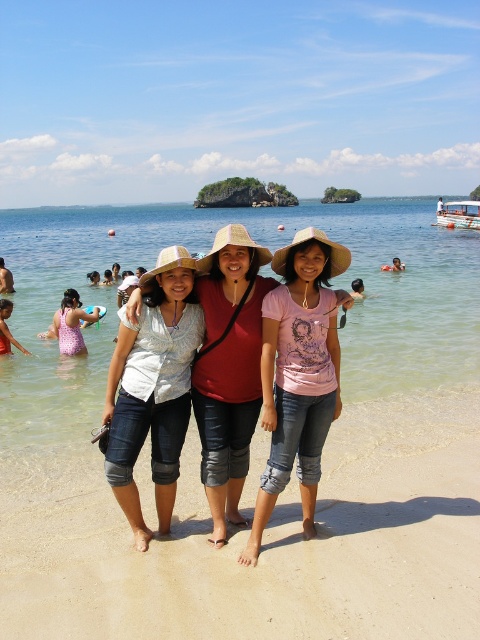
Is denim jeans at center wider than clear water at beach center?

No.

Does denim jeans at center appear over clear water at beach center?

Incorrect, denim jeans at center is not positioned above clear water at beach center.

Describe the element at coordinates (265, 544) in the screenshot. I see `denim jeans at center` at that location.

Where is `denim jeans at center`? The height and width of the screenshot is (640, 480). denim jeans at center is located at coordinates (265, 544).

The width and height of the screenshot is (480, 640). Identify the location of clear water at beach center. (206, 250).

Can you confirm if clear water at beach center is positioned to the left of pink fabric swimsuit at left?

No, clear water at beach center is not to the left of pink fabric swimsuit at left.

Measure the distance between clear water at beach center and camera.

clear water at beach center is 5.27 meters away from camera.

Where is `clear water at beach center`? The image size is (480, 640). clear water at beach center is located at coordinates (206, 250).

Which is more to the right, pink matte shirt at center or matte pink shirt at center?

pink matte shirt at center is more to the right.

Who is shorter, pink matte shirt at center or matte pink shirt at center?

With less height is pink matte shirt at center.

Does point (288, 448) come in front of point (196, 387)?

Yes, point (288, 448) is closer to viewer.

Where is `pink matte shirt at center`? pink matte shirt at center is located at coordinates (298, 374).